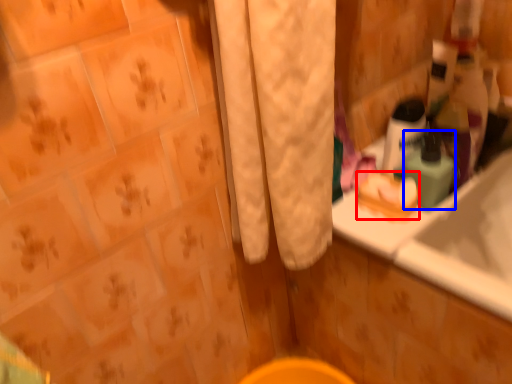
Question: Which point is closer to the camera, soap (highlighted by a red box) or mouthwash (highlighted by a blue box)?

Choices:
 (A) soap
 (B) mouthwash

Answer: (B)